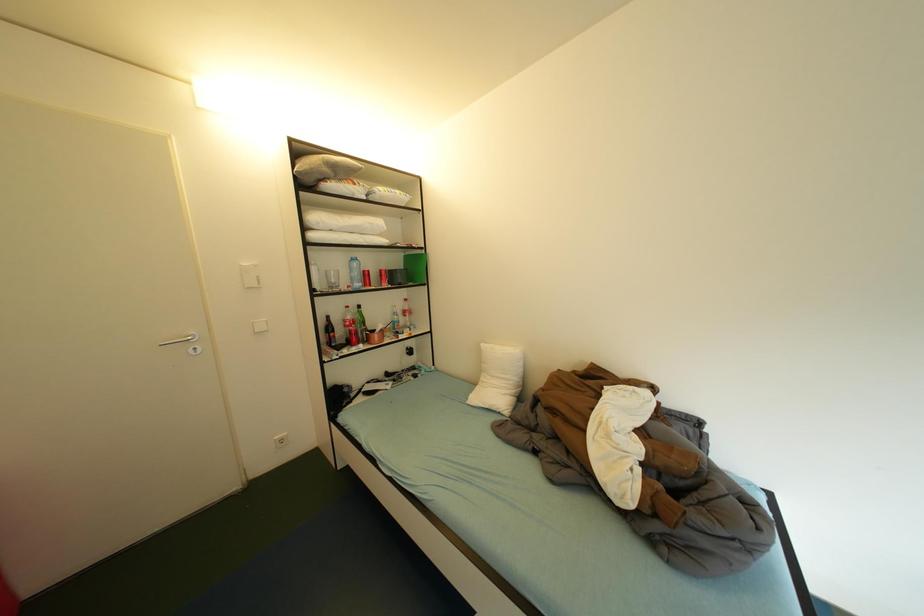
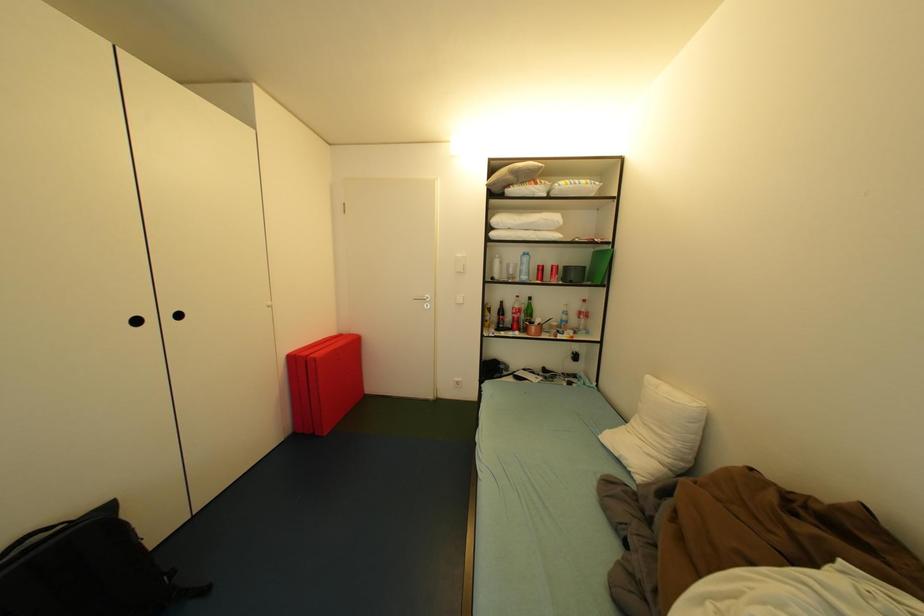
Question: The camera is either moving clockwise (left) or counter-clockwise (right) around the object. The first image is from the beginning of the video and the second image is from the end. Is the camera moving left or right when shooting the video?

Choices:
 (A) Left
 (B) Right

Answer: (B)